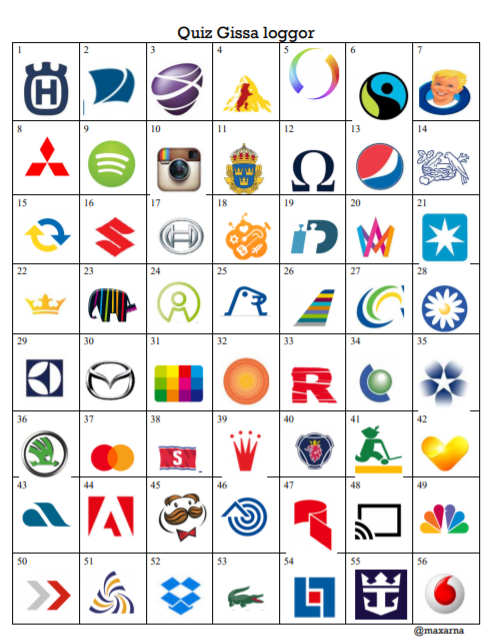
You are a GUI agent. You are given a task and a screenshot of the screen. Output one action in this format:
    pyautogui.click(x=<x>, y=<y>)
    Task: Click on the boxes in the corners
    
    Given the screenshot: What is the action you would take?
    pyautogui.click(x=440, y=595), pyautogui.click(x=43, y=602), pyautogui.click(x=460, y=64), pyautogui.click(x=41, y=73)